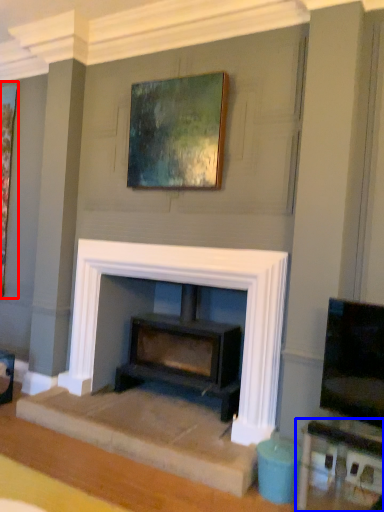
Question: Which object is further to the camera taking this photo, picture frame (highlighted by a red box) or table (highlighted by a blue box)?

Choices:
 (A) picture frame
 (B) table

Answer: (A)